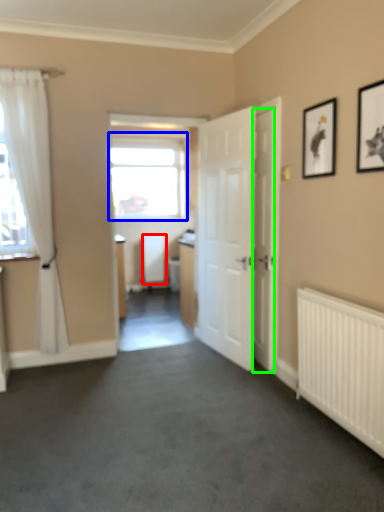
Question: Which object is positioned farthest from radiator (highlighted by a red box)? Select from window (highlighted by a blue box) and door (highlighted by a green box).

Choices:
 (A) window
 (B) door

Answer: (B)